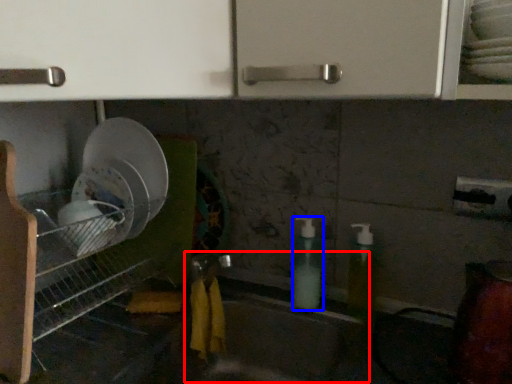
Question: Which object appears closest to the camera in this image, sink (highlighted by a red box) or soap dispenser (highlighted by a blue box)?

Choices:
 (A) sink
 (B) soap dispenser

Answer: (A)